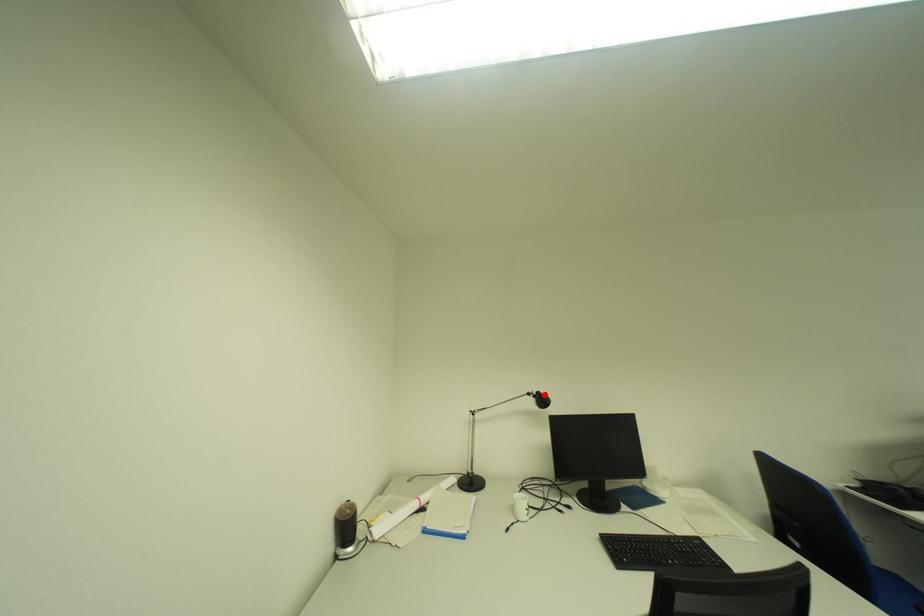
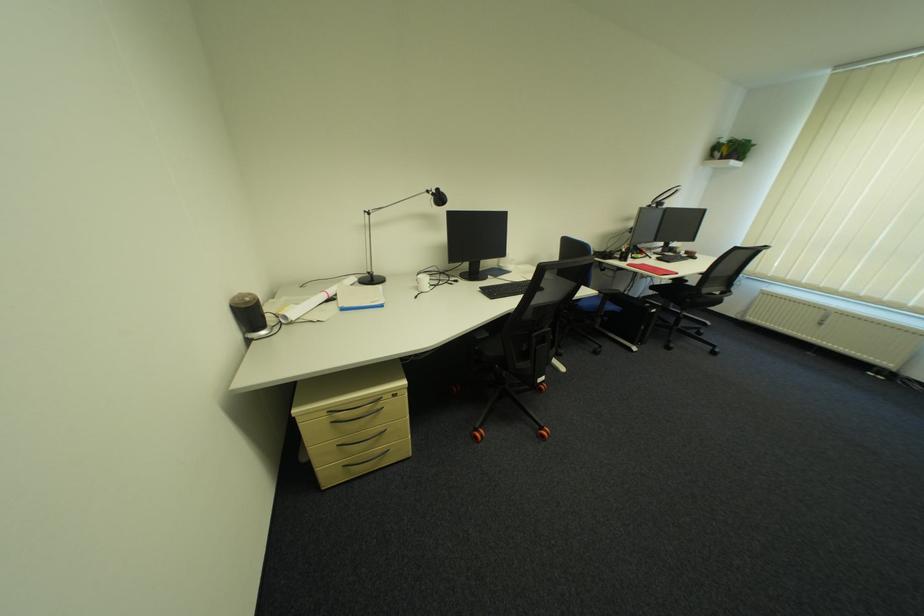
Question: I am providing you with two images of the same scene from different viewpoints. A red point is shown in image1. For the corresponding object point in image2, is it positioned nearer or farther from the camera?

Choices:
 (A) Nearer
 (B) Farther

Answer: (A)